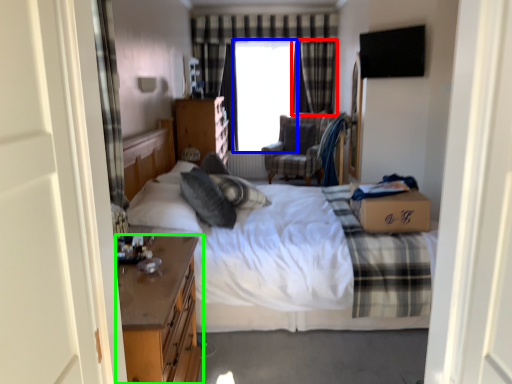
Question: Which is nearer to the curtain (highlighted by a red box)? window screen (highlighted by a blue box) or nightstand (highlighted by a green box).

Choices:
 (A) window screen
 (B) nightstand

Answer: (A)